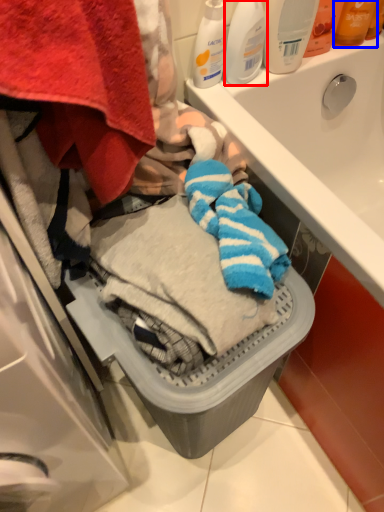
Question: Which object appears farthest to the camera in this image, cleaning product (highlighted by a red box) or toiletry (highlighted by a blue box)?

Choices:
 (A) cleaning product
 (B) toiletry

Answer: (B)